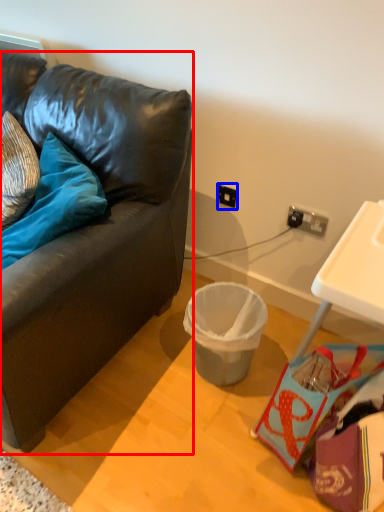
Question: Which object is further to the camera taking this photo, studio couch (highlighted by a red box) or power outlet (highlighted by a blue box)?

Choices:
 (A) studio couch
 (B) power outlet

Answer: (B)